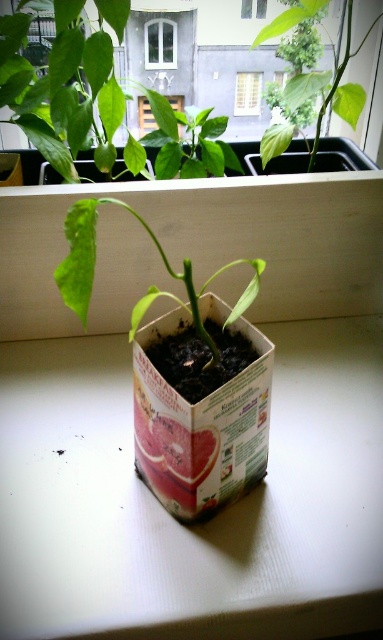
Question: Can you confirm if green matte leafy plant at upper center is positioned above transparent glass window at upper center?

Choices:
 (A) no
 (B) yes

Answer: (A)

Question: Is green matte plant at center positioned at the back of green matte leafy plant at upper center?

Choices:
 (A) yes
 (B) no

Answer: (B)

Question: Among these objects, which one is nearest to the camera?

Choices:
 (A) white wooden window at upper center
 (B) transparent glass window at upper center
 (C) white plastic window at upper center

Answer: (A)

Question: Which object appears closest to the camera in this image?

Choices:
 (A) green matte leafy plant at upper center
 (B) cardboard box at center
 (C) transparent glass window at upper center
 (D) white plastic window at upper center

Answer: (B)

Question: Is cardboard box at center thinner than white plastic window at upper center?

Choices:
 (A) yes
 (B) no

Answer: (B)

Question: Which object is closer to the camera taking this photo?

Choices:
 (A) green matte leafy plant at center
 (B) transparent glass window at upper center
 (C) white plastic window at upper center
 (D) cardboard box at center

Answer: (D)